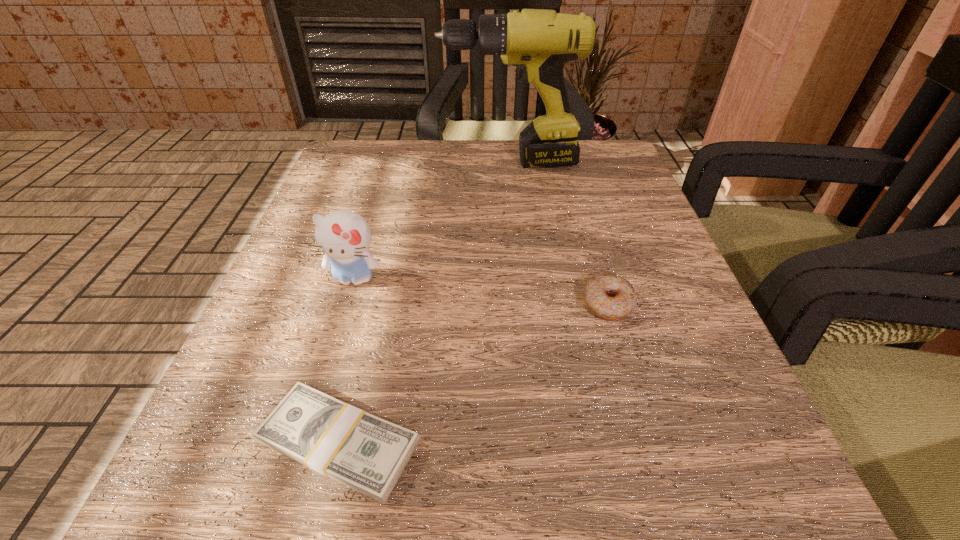
This screenshot has width=960, height=540. What are the coordinates of `vacant space at the far edge of the desktop` in the screenshot? It's located at (471, 171).

In the image, there is a desktop. Find the location of `vacant space at the near edge`. vacant space at the near edge is located at coordinates (421, 523).

Where is `free space at the left edge of the desktop`? free space at the left edge of the desktop is located at coordinates (330, 317).

The width and height of the screenshot is (960, 540). In the image, there is a desktop. What are the coordinates of `vacant area at the right edge` in the screenshot? It's located at tap(681, 369).

The image size is (960, 540). In the image, there is a desktop. In order to click on vacant space at the far right corner in this screenshot , I will do `click(620, 180)`.

Where is `vacant space at the near right corner of the desktop`? vacant space at the near right corner of the desktop is located at coordinates (674, 482).

Where is `vacant area that lies between the nearest object and the drill`? Image resolution: width=960 pixels, height=540 pixels. vacant area that lies between the nearest object and the drill is located at coordinates (424, 302).

Image resolution: width=960 pixels, height=540 pixels. What are the coordinates of `vacant space in between the nearest object and the second tallest object` in the screenshot? It's located at (347, 361).

I want to click on vacant space that is in between the kitten and the farthest object, so click(431, 221).

I want to click on unoccupied position between the doughnut and the dollar, so click(x=473, y=373).